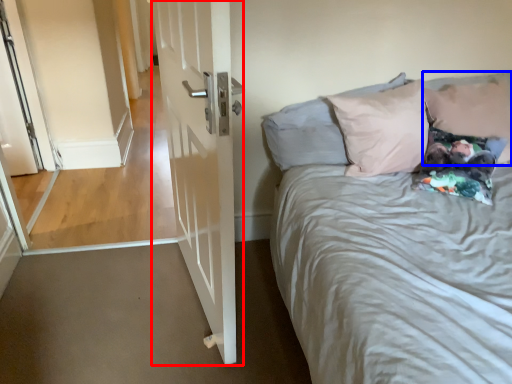
Question: Which of the following is the farthest to the observer, door (highlighted by a red box) or pillow (highlighted by a blue box)?

Choices:
 (A) door
 (B) pillow

Answer: (B)